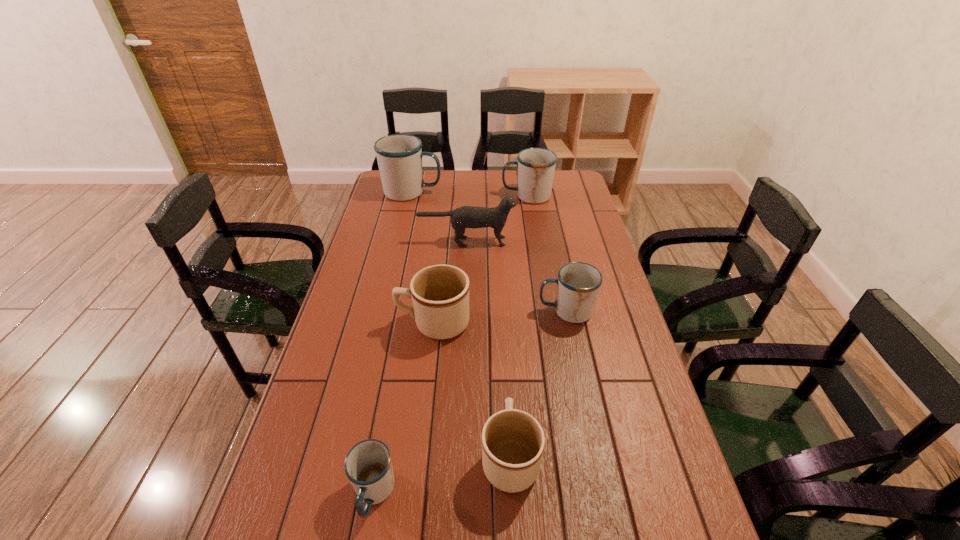
Locate an element on the screen. This screenshot has width=960, height=540. vacant space located 0.380m on the handle side of the third farthest white mug is located at coordinates (419, 311).

The image size is (960, 540). Find the location of `vacant area situated 0.050m on the handle side of the third farthest white mug`. vacant area situated 0.050m on the handle side of the third farthest white mug is located at coordinates (522, 311).

You are a GUI agent. You are given a task and a screenshot of the screen. Output one action in this format:
    pyautogui.click(x=<x>, y=<y>)
    Task: Click on the vacant region located 0.170m on the side of the nearer brown mug with the handle
    The image size is (960, 540).
    Given the screenshot: What is the action you would take?
    pyautogui.click(x=505, y=368)

Where is `vacant position located 0.170m on the side of the nearer brown mug with the handle`? This screenshot has width=960, height=540. vacant position located 0.170m on the side of the nearer brown mug with the handle is located at coordinates (505, 368).

Locate an element on the screen. This screenshot has width=960, height=540. free region located on the side of the nearer brown mug with the handle is located at coordinates (503, 324).

Where is `object present at the left edge`? object present at the left edge is located at coordinates (399, 156).

Locate an element on the screen. This screenshot has height=540, width=960. object positioned at the far left corner is located at coordinates (399, 156).

Image resolution: width=960 pixels, height=540 pixels. I want to click on object at the far right corner, so click(x=536, y=166).

Where is `vacant space at the far edge`? vacant space at the far edge is located at coordinates point(432,196).

At what (x,y) coordinates should I click in order to perform the action: click on vacant position at the left edge of the desktop. Please return your answer as a coordinate pair (x, y). Looking at the image, I should click on (355, 354).